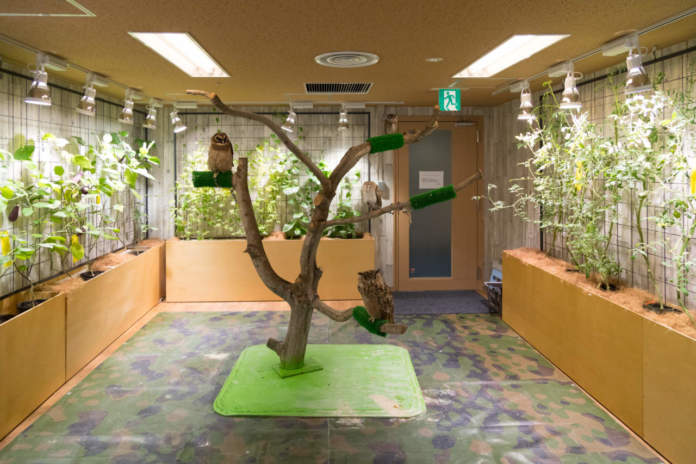
Identify the location of mat. The width and height of the screenshot is (696, 464). (360, 379), (481, 344).